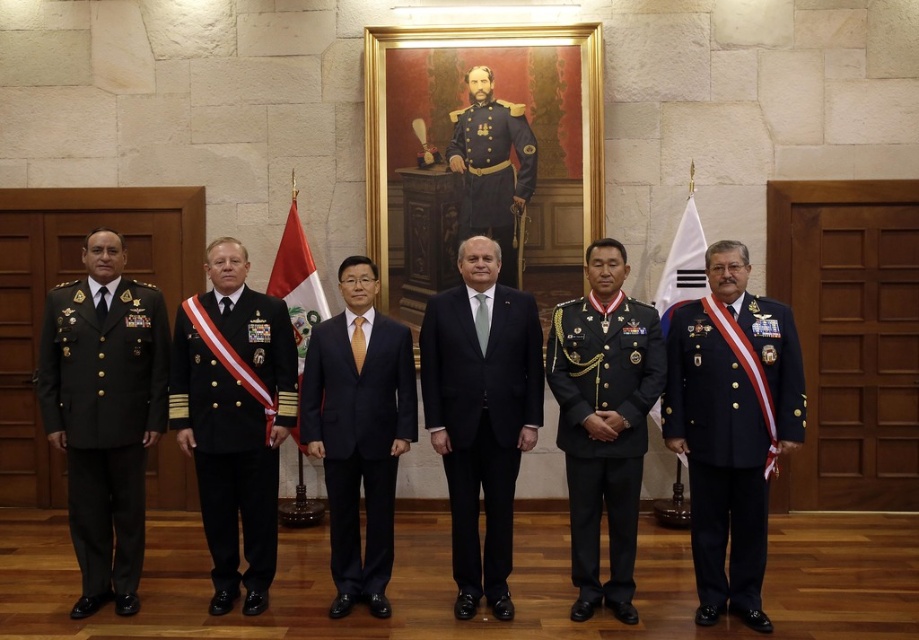
You are a photographer adjusting the lighting for the group photo. The shiny black fabric military uniform at center and the dark blue fabric uniform at center are both in the frame. Which uniform requires more light to avoid appearing too dark in the photo?

The shiny black fabric military uniform at center requires more light because shiny materials reflect more light and may need additional illumination to prevent overexposure or loss of detail.

You are attending a formal event and notice two uniforms in the center of the image. Which one is closer to you, the shiny black fabric military uniform at center or the dark blue fabric uniform at center?

The shiny black fabric military uniform at center is closer to the viewer than the dark blue fabric uniform at center.

You are attending a formal event and need to choose an outfit based on the image. Which of the two outfits, the black satin suit at center or the dark blue fabric uniform at center, would you select if you want to wear the larger option?

The black satin suit at center has a larger size compared to the dark blue fabric uniform at center, so you should choose the black satin suit at center.